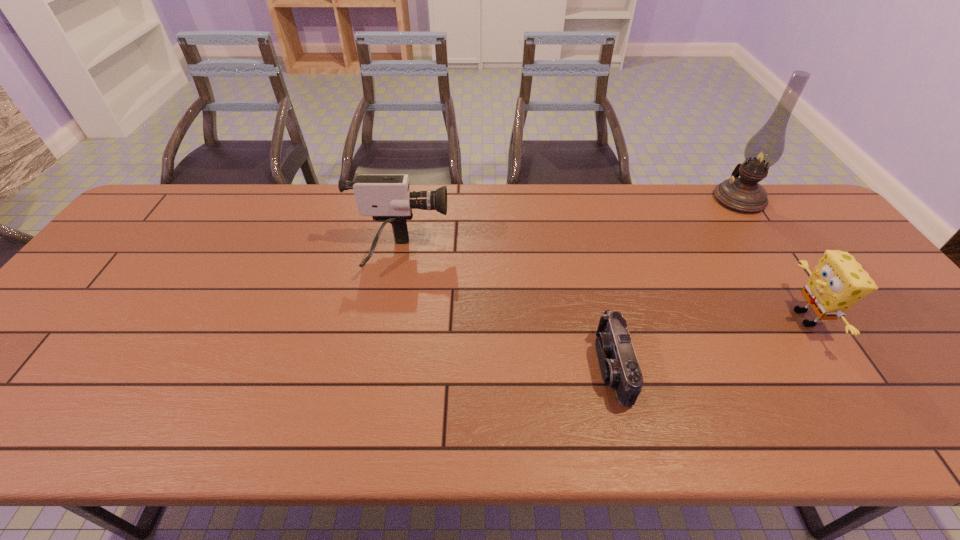
The width and height of the screenshot is (960, 540). In the image, there is a desktop. What are the coordinates of `vacant space at the near edge` in the screenshot? It's located at (529, 403).

In order to click on vacant region at the left edge in this screenshot , I will do `click(59, 324)`.

This screenshot has width=960, height=540. I want to click on vacant space at the right edge, so click(853, 307).

Locate an element on the screen. Image resolution: width=960 pixels, height=540 pixels. free space at the far left corner is located at coordinates (204, 189).

You are a GUI agent. You are given a task and a screenshot of the screen. Output one action in this format:
    pyautogui.click(x=<x>, y=<y>)
    Task: Click on the free region at the near left corner of the desktop
    
    Given the screenshot: What is the action you would take?
    pyautogui.click(x=37, y=422)

Image resolution: width=960 pixels, height=540 pixels. In order to click on vacant region between the right camcorder and the third shortest object in this screenshot , I will do `click(506, 311)`.

Where is `unoccupied position between the leftmost object and the shorter camcorder`? unoccupied position between the leftmost object and the shorter camcorder is located at coordinates (506, 311).

Locate an element on the screen. empty space that is in between the shorter camcorder and the leftmost object is located at coordinates tap(506, 311).

This screenshot has width=960, height=540. Identify the location of free spot between the farthest object and the right camcorder. (676, 283).

This screenshot has width=960, height=540. I want to click on vacant area that lies between the taller camcorder and the third tallest object, so click(x=603, y=287).